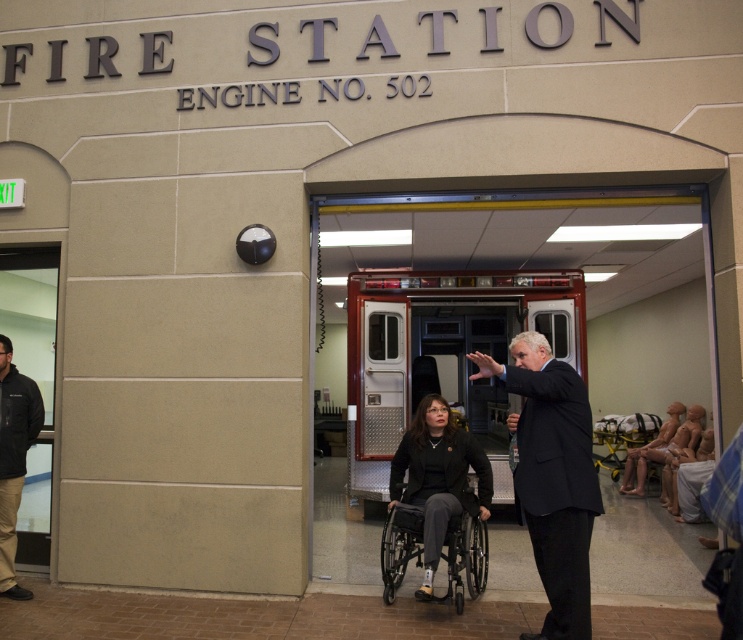
Which is in front, point (571, 497) or point (19, 592)?

Point (571, 497) is more forward.

The height and width of the screenshot is (640, 743). I want to click on dark suit at center, so click(551, 476).

Is metallic silver fire truck at center below black jacket at left?

Incorrect, metallic silver fire truck at center is not positioned below black jacket at left.

Is metallic silver fire truck at center wider than black jacket at left?

Indeed, metallic silver fire truck at center has a greater width compared to black jacket at left.

Image resolution: width=743 pixels, height=640 pixels. What do you see at coordinates (444, 355) in the screenshot?
I see `metallic silver fire truck at center` at bounding box center [444, 355].

At what (x,y) coordinates should I click in order to perform the action: click on metallic silver fire truck at center. Please return your answer as a coordinate pair (x, y). This screenshot has width=743, height=640. Looking at the image, I should click on (444, 355).

Does black plastic wheelchair at center come in front of smooth beige mannequin at right?

Yes, black plastic wheelchair at center is in front of smooth beige mannequin at right.

Is point (467, 561) positioned in front of point (626, 484)?

Yes.

You are a GUI agent. You are given a task and a screenshot of the screen. Output one action in this format:
    pyautogui.click(x=<x>, y=<y>)
    Task: Click on the black plastic wheelchair at center
    Image resolution: width=743 pixels, height=640 pixels.
    Given the screenshot: What is the action you would take?
    pyautogui.click(x=464, y=557)